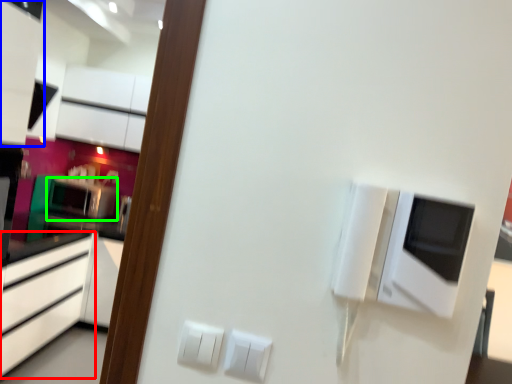
Question: Considering the real-world distances, which object is farthest from cabinetry (highlighted by a red box)? cabinetry (highlighted by a blue box) or appliance (highlighted by a green box)?

Choices:
 (A) cabinetry
 (B) appliance

Answer: (A)